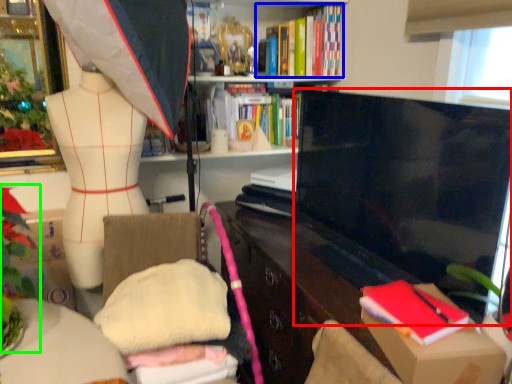
Question: Based on their relative distances, which object is farther from television (highlighted by a red box)? Choose from book (highlighted by a blue box) and floral arrangement (highlighted by a green box).

Choices:
 (A) book
 (B) floral arrangement

Answer: (B)